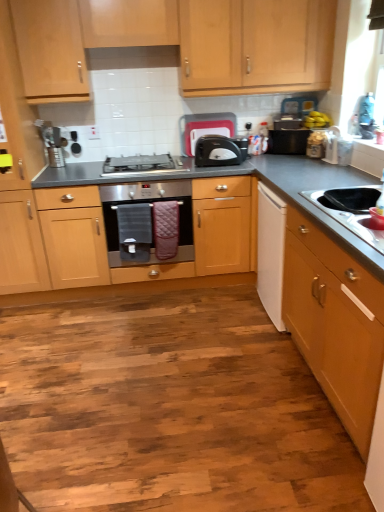
You are a GUI agent. You are given a task and a screenshot of the screen. Output one action in this format:
    pyautogui.click(x=<x>, y=<y>)
    Task: Click on the free space in front of black plastic microwave at upper right, acting as the 4th appliance starting from the left
    
    Given the screenshot: What is the action you would take?
    pyautogui.click(x=292, y=157)